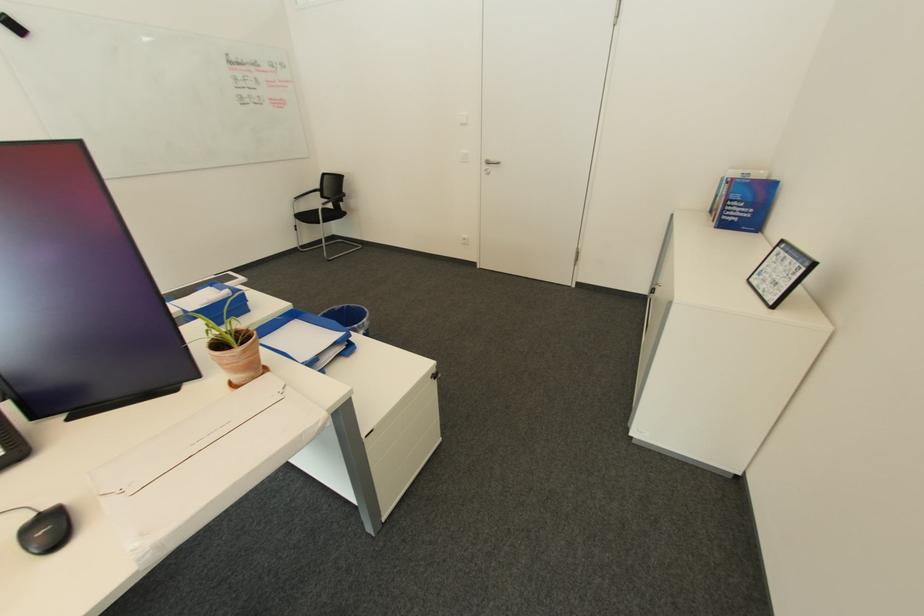
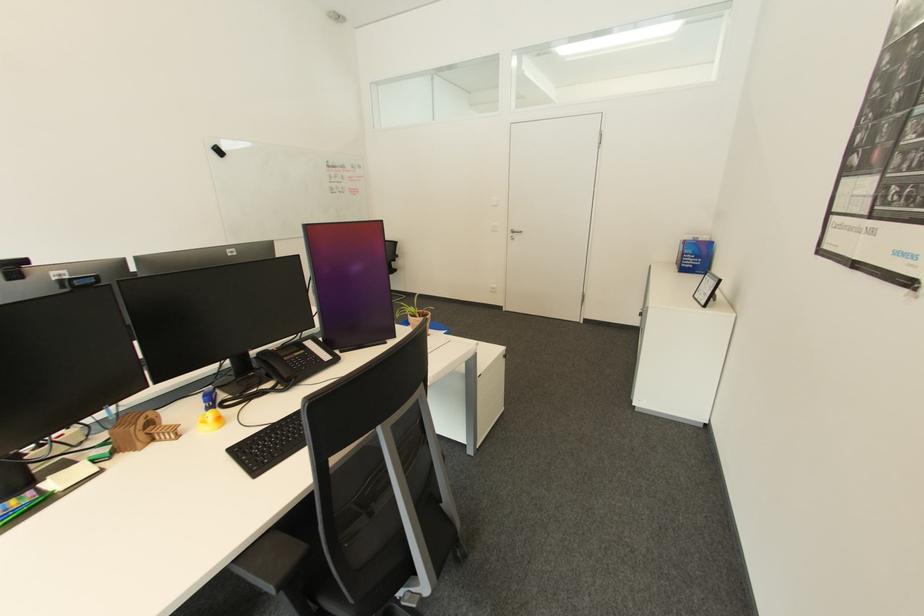
In a continuous first-person perspective shot, in which direction is the camera moving?

The cameraman walked toward left, backward.